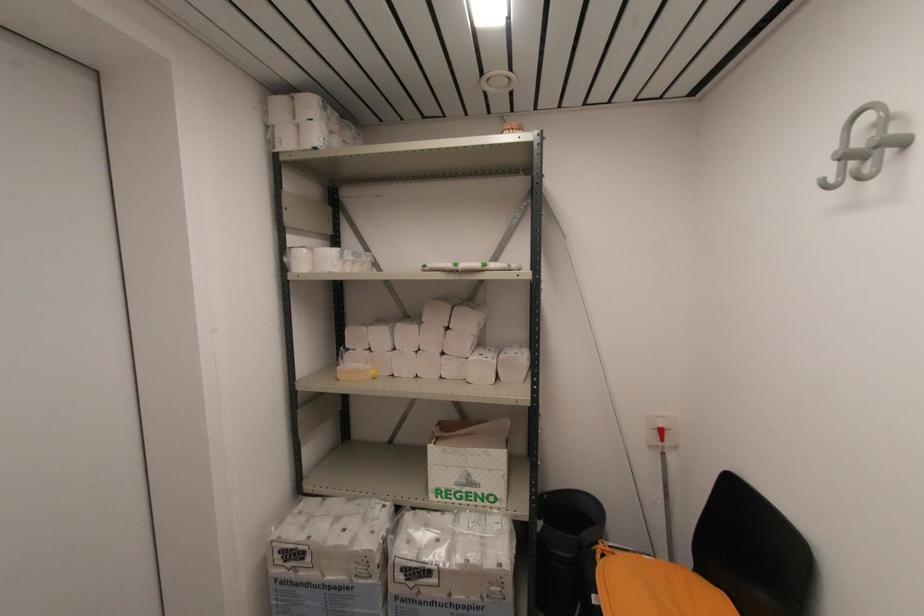
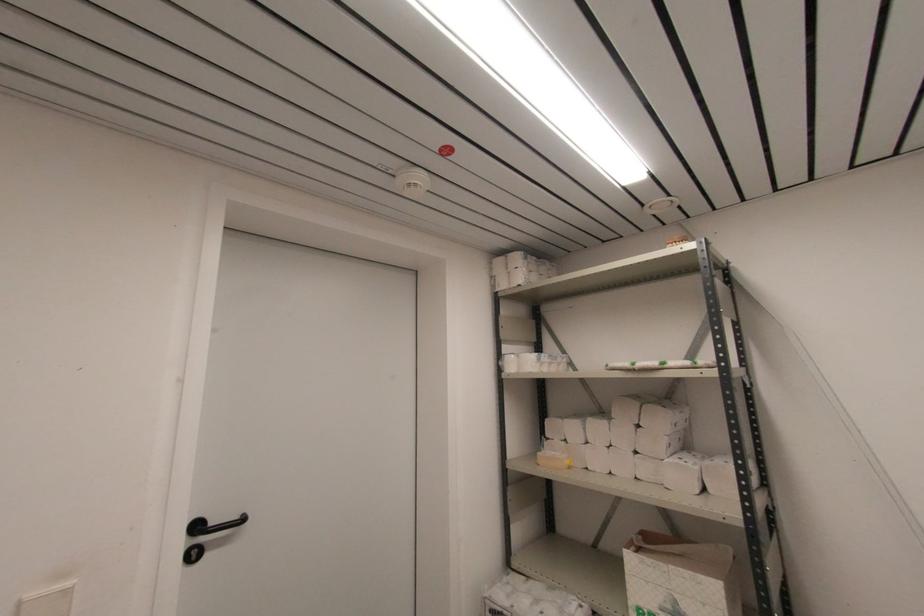
Where in the second image is the point corresponding to pixel 322 145 from the first image?

(524, 282)